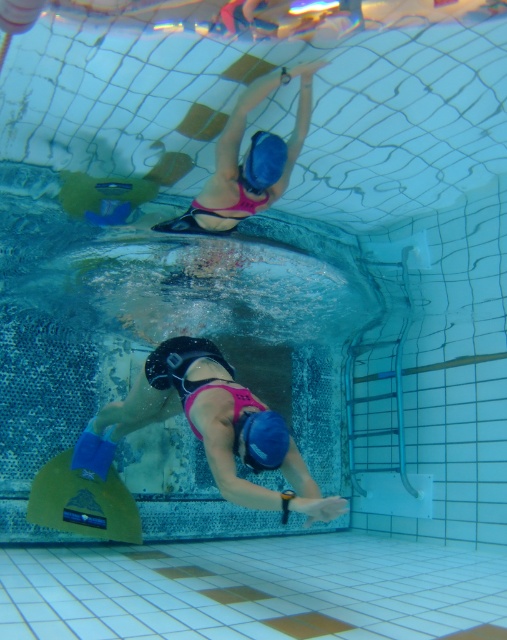
Question: Is pink matte swimsuit at center to the right of matte blue snorkel at upper center from the viewer's perspective?

Choices:
 (A) no
 (B) yes

Answer: (A)

Question: Which point appears farthest from the camera in this image?

Choices:
 (A) (242, 202)
 (B) (316, 484)

Answer: (A)

Question: Which object is farther from the camera taking this photo?

Choices:
 (A) pink matte swimsuit at center
 (B) matte blue snorkel at upper center

Answer: (B)

Question: Is pink matte swimsuit at center smaller than matte blue snorkel at upper center?

Choices:
 (A) yes
 (B) no

Answer: (B)

Question: Is pink matte swimsuit at center closer to the viewer compared to matte blue snorkel at upper center?

Choices:
 (A) yes
 (B) no

Answer: (A)

Question: Among these objects, which one is farthest from the camera?

Choices:
 (A) matte blue snorkel at upper center
 (B) pink matte swimsuit at center

Answer: (A)